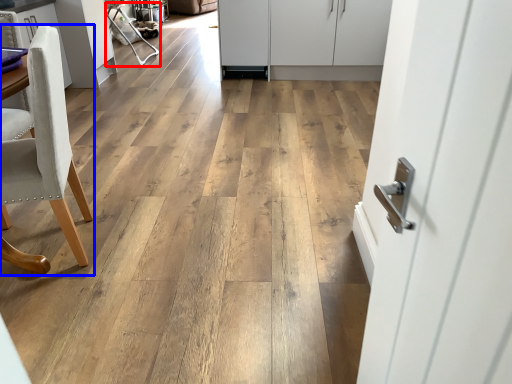
Question: Which object is further to the camera taking this photo, armchair (highlighted by a red box) or chair (highlighted by a blue box)?

Choices:
 (A) armchair
 (B) chair

Answer: (A)